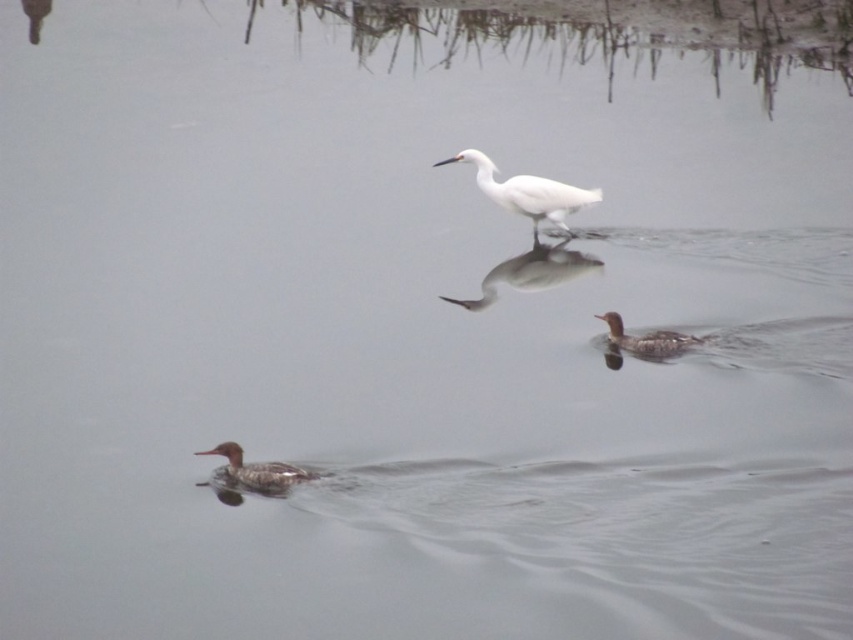
Can you confirm if brown matte duck at lower left is bigger than brown matte duck at center-right?

Incorrect, brown matte duck at lower left is not larger than brown matte duck at center-right.

Between point (252, 488) and point (640, 352), which one is positioned behind?

The point (640, 352) is more distant.

You are a GUI agent. You are given a task and a screenshot of the screen. Output one action in this format:
    pyautogui.click(x=<x>, y=<y>)
    Task: Click on the brown matte duck at lower left
    
    Given the screenshot: What is the action you would take?
    pyautogui.click(x=256, y=470)

You are a GUI agent. You are given a task and a screenshot of the screen. Output one action in this format:
    pyautogui.click(x=<x>, y=<y>)
    Task: Click on the white matte bird at center
    The width and height of the screenshot is (853, 640).
    Given the screenshot: What is the action you would take?
    pyautogui.click(x=527, y=192)

Can you confirm if white matte bird at center is positioned to the left of brown matte duck at lower left?

In fact, white matte bird at center is to the right of brown matte duck at lower left.

The width and height of the screenshot is (853, 640). Describe the element at coordinates (527, 192) in the screenshot. I see `white matte bird at center` at that location.

Locate an element on the screen. white matte bird at center is located at coordinates (527, 192).

Is white matte bird at center closer to the viewer compared to brown matte duck at center-right?

No, it is behind brown matte duck at center-right.

Looking at this image, is white matte bird at center positioned behind brown matte duck at center-right?

Yes, it is.

Is point (573, 209) behind point (614, 314)?

Yes.

This screenshot has height=640, width=853. What are the coordinates of `white matte bird at center` in the screenshot? It's located at (527, 192).